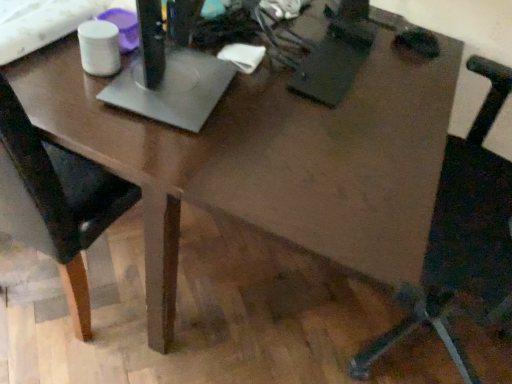
Question: Could you tell me if black leather chair at right, which is the 1th chair in right-to-left order, is facing black leather chair at left, which is counted as the first chair, starting from the left?

Choices:
 (A) yes
 (B) no

Answer: (A)

Question: From the image's perspective, is black leather chair at right, which is the 1th chair in right-to-left order, above black leather chair at left, which is counted as the first chair, starting from the left?

Choices:
 (A) no
 (B) yes

Answer: (A)

Question: Is black leather chair at right, which is the 2th chair from left to right, shorter than black leather chair at left, the second chair viewed from the right?

Choices:
 (A) yes
 (B) no

Answer: (B)

Question: Is there a large distance between black leather chair at right, which is the 2th chair from left to right, and black leather chair at left, which is counted as the first chair, starting from the left?

Choices:
 (A) yes
 (B) no

Answer: (B)

Question: Can you confirm if black leather chair at right, which is the 2th chair from left to right, is bigger than black leather chair at left, the second chair viewed from the right?

Choices:
 (A) yes
 (B) no

Answer: (A)

Question: Is black leather chair at right, which is the 2th chair from left to right, oriented away from black leather chair at left, the second chair viewed from the right?

Choices:
 (A) yes
 (B) no

Answer: (B)

Question: Is black leather chair at left, the second chair viewed from the right, further to the viewer compared to black leather chair at right, which is the 2th chair from left to right?

Choices:
 (A) yes
 (B) no

Answer: (A)

Question: Is black leather chair at left, the second chair viewed from the right, bigger than black leather chair at right, which is the 1th chair in right-to-left order?

Choices:
 (A) yes
 (B) no

Answer: (B)

Question: Can you confirm if black leather chair at left, the second chair viewed from the right, is positioned to the right of black leather chair at right, which is the 2th chair from left to right?

Choices:
 (A) yes
 (B) no

Answer: (B)

Question: Does black leather chair at left, which is counted as the first chair, starting from the left, have a lesser height compared to black leather chair at right, which is the 2th chair from left to right?

Choices:
 (A) no
 (B) yes

Answer: (B)

Question: Is black leather chair at left, the second chair viewed from the right, positioned beyond the bounds of black leather chair at right, which is the 2th chair from left to right?

Choices:
 (A) yes
 (B) no

Answer: (A)

Question: Considering the relative sizes of black leather chair at left, which is counted as the first chair, starting from the left, and black leather chair at right, which is the 2th chair from left to right, in the image provided, is black leather chair at left, which is counted as the first chair, starting from the left, thinner than black leather chair at right, which is the 2th chair from left to right,?

Choices:
 (A) no
 (B) yes

Answer: (B)

Question: Considering the relative positions of black leather chair at left, which is counted as the first chair, starting from the left, and black leather chair at right, which is the 2th chair from left to right, in the image provided, is black leather chair at left, which is counted as the first chair, starting from the left, to the left or to the right of black leather chair at right, which is the 2th chair from left to right,?

Choices:
 (A) left
 (B) right

Answer: (A)